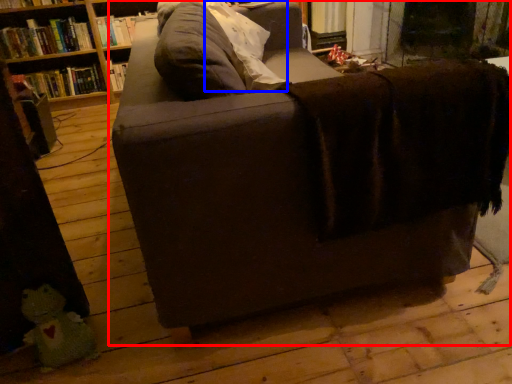
Question: Which point is further to the camera, studio couch (highlighted by a red box) or pillow (highlighted by a blue box)?

Choices:
 (A) studio couch
 (B) pillow

Answer: (B)